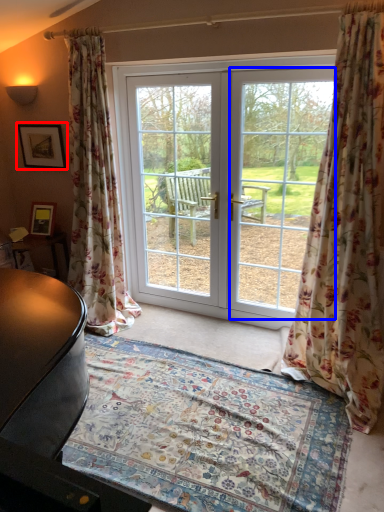
Question: Among these objects, which one is farthest to the camera, picture frame (highlighted by a red box) or window screen (highlighted by a blue box)?

Choices:
 (A) picture frame
 (B) window screen

Answer: (A)